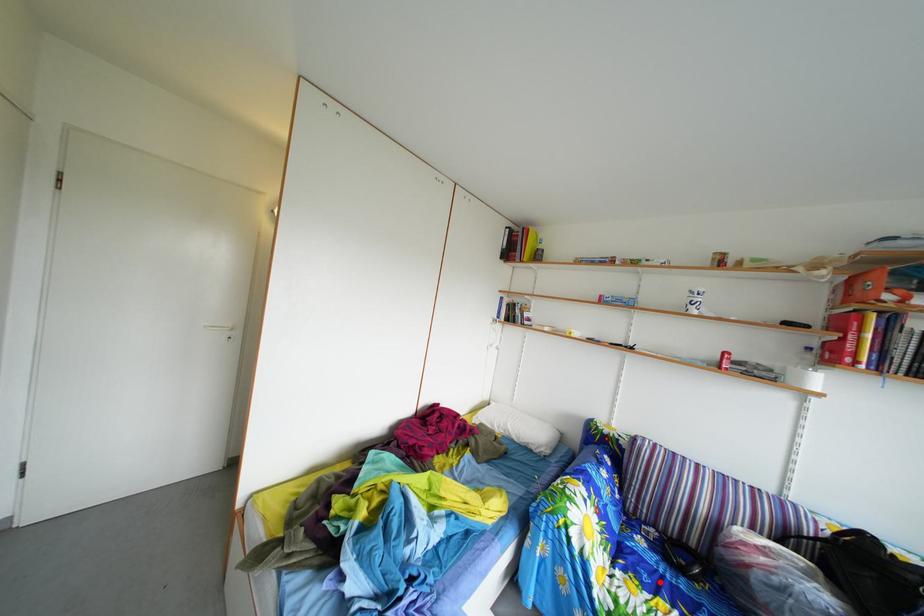
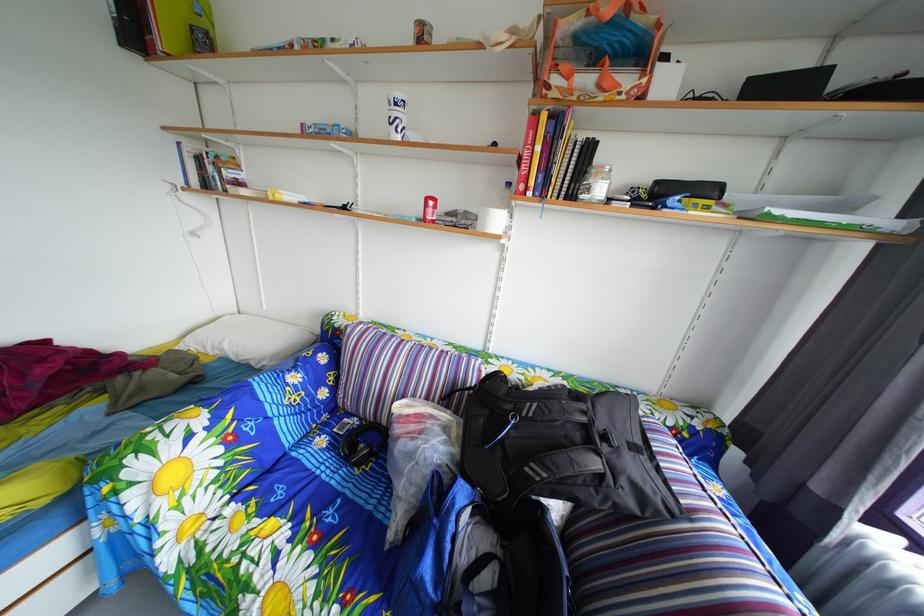
In the second image, find the point that corresponds to the highlighted location in the first image.

(301, 493)